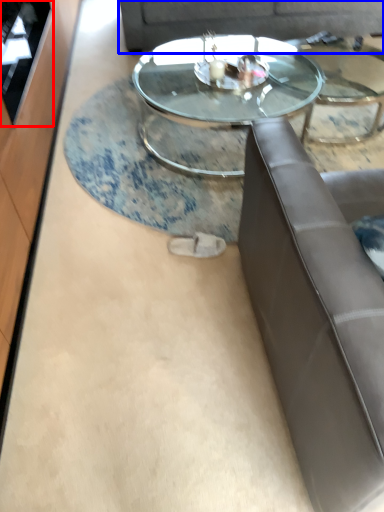
Question: Which point is further to the camera, glass door (highlighted by a red box) or couch (highlighted by a blue box)?

Choices:
 (A) glass door
 (B) couch

Answer: (B)